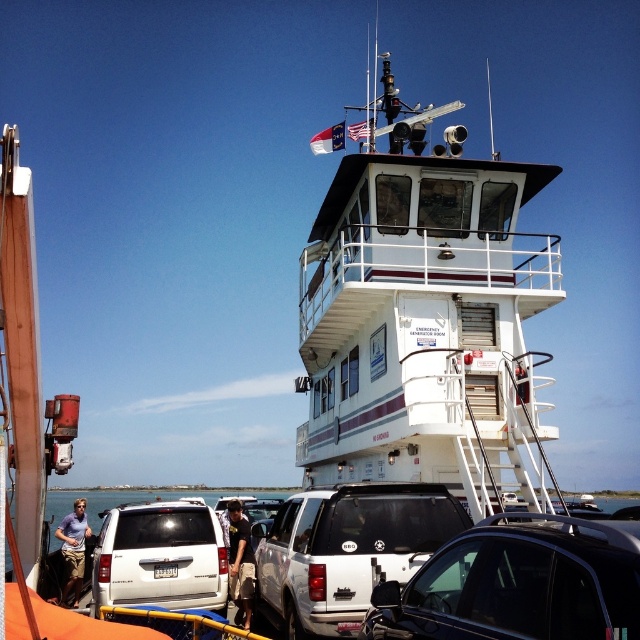
In the scene shown: You are a delivery person who needs to place a package between the metallic silver suv at center and the white matte suv at center. The package requires a space of 10 feet to be placed safely. Can you fit the package between them?

The distance between the metallic silver suv at center and the white matte suv at center is 8.64 feet, which is less than the required 10 feet. Therefore, the package cannot be safely placed between them.

You are a passenger on the ferry and need to find your dark brown leather jacket at center. You see the white matte suv at lower left nearby. Can you tell me which object is bigger?

The white matte suv at lower left is larger than the dark brown leather jacket at center.

You are standing at the ferry terminal and see the white glossy boat at upper center. There is a point marked at coordinates (x=426, y=316). Can you tell me where exactly this point is located on the boat?

The point at coordinates (x=426, y=316) is located on the white glossy boat at upper center.